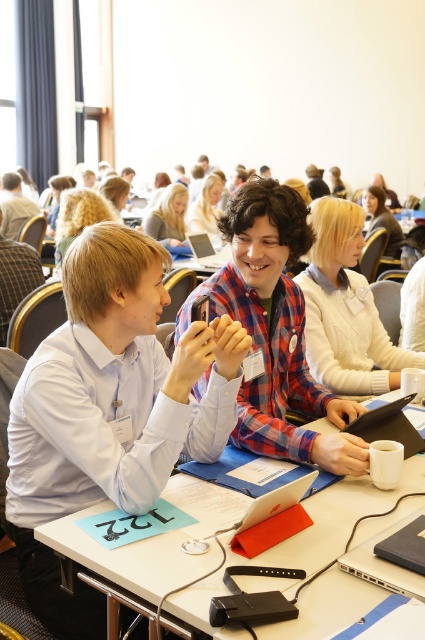
Question: Is plaid fabric shirt at center smaller than silver metallic laptop at center?

Choices:
 (A) no
 (B) yes

Answer: (A)

Question: Can you confirm if light blue shirt at center is positioned below matte white shirt at center?

Choices:
 (A) yes
 (B) no

Answer: (A)

Question: Considering the real-world distances, which object is closest to the white knit sweater at center?

Choices:
 (A) matte white shirt at center
 (B) white plastic table at center
 (C) light blue shirt at center

Answer: (B)

Question: Which object is positioned farthest from the silver metallic laptop at center?

Choices:
 (A) matte white shirt at center
 (B) white plastic table at center

Answer: (B)

Question: Is the position of light blue shirt at center less distant than that of matte white shirt at center?

Choices:
 (A) yes
 (B) no

Answer: (A)

Question: Which is nearer to the light blue shirt at center?

Choices:
 (A) white knit sweater at center
 (B) plaid fabric shirt at center
 (C) white plastic table at center

Answer: (C)